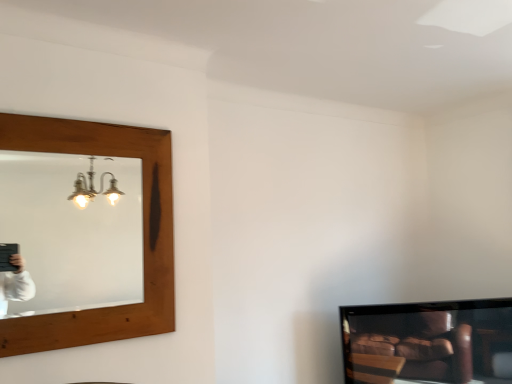
Question: Considering their positions, is matte black television at lower right located in front of or behind wooden mirror at upper left?

Choices:
 (A) front
 (B) behind

Answer: (B)

Question: From a real-world perspective, is matte black television at lower right physically located above or below wooden mirror at upper left?

Choices:
 (A) above
 (B) below

Answer: (B)

Question: Looking at their shapes, would you say matte black television at lower right is wider or thinner than wooden mirror at upper left?

Choices:
 (A) thin
 (B) wide

Answer: (B)

Question: Considering the positions of wooden mirror at upper left and matte black television at lower right in the image, is wooden mirror at upper left wider or thinner than matte black television at lower right?

Choices:
 (A) wide
 (B) thin

Answer: (B)

Question: Is wooden mirror at upper left situated inside matte black television at lower right or outside?

Choices:
 (A) inside
 (B) outside

Answer: (B)

Question: Is point (87, 304) positioned closer to the camera than point (401, 321)?

Choices:
 (A) farther
 (B) closer

Answer: (A)

Question: Based on their sizes in the image, would you say wooden mirror at upper left is bigger or smaller than matte black television at lower right?

Choices:
 (A) small
 (B) big

Answer: (A)